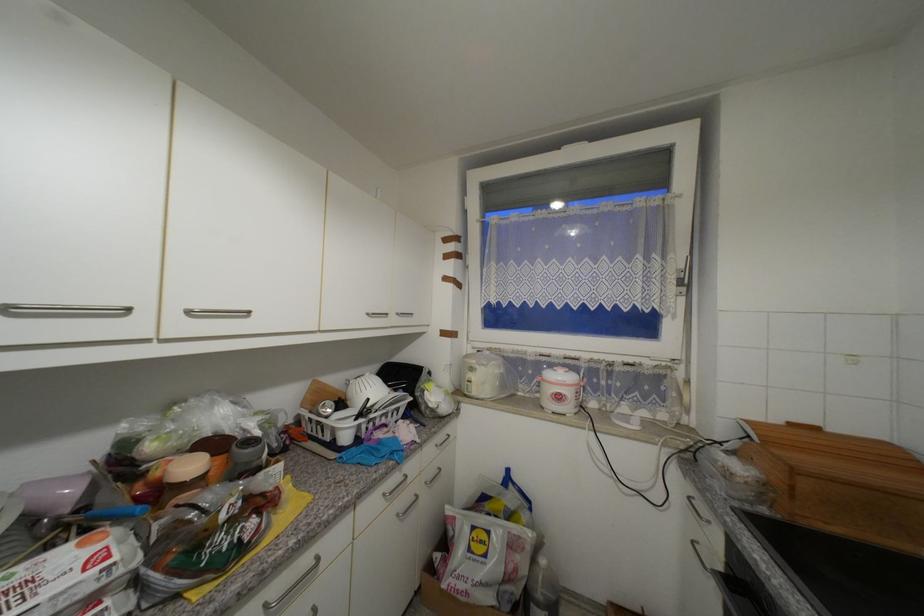
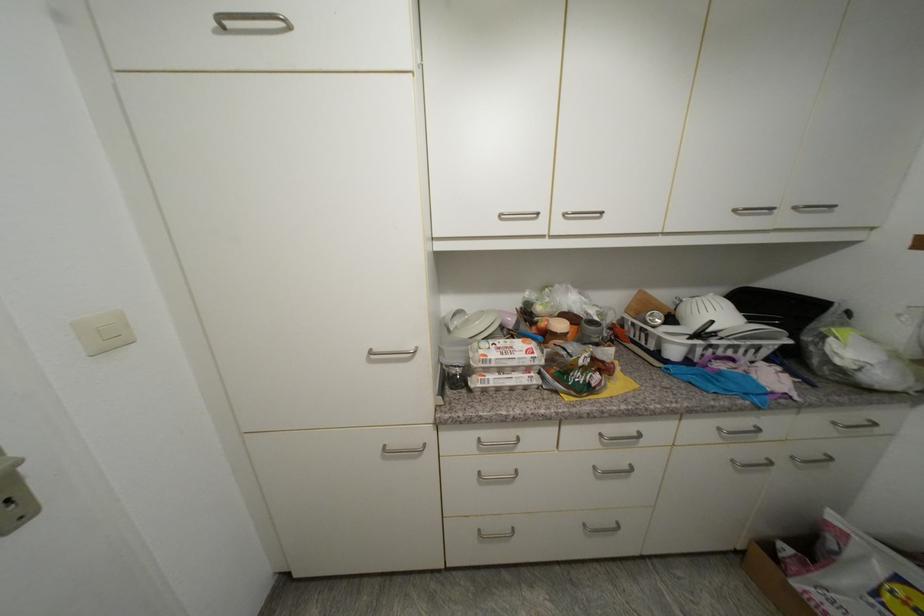
In the second image, find the point that corresponds to point (321, 383) in the first image.

(647, 294)